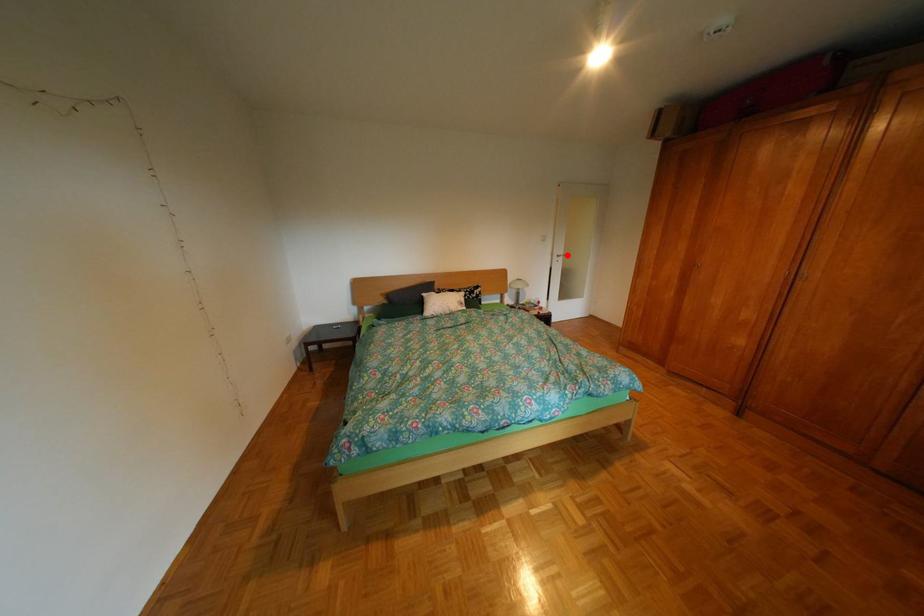
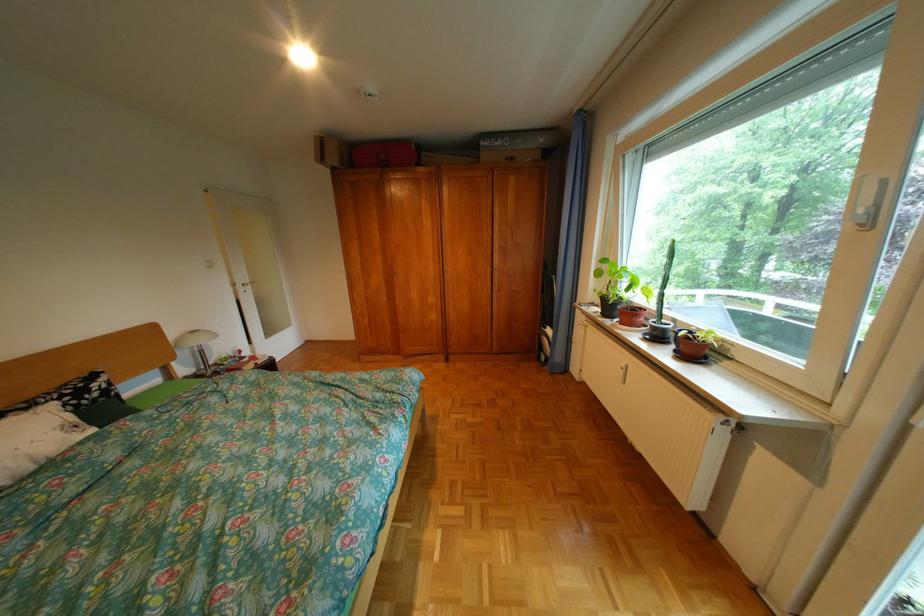
Where in the second image is the point corresponding to the highlighted location from the first image?

(248, 285)